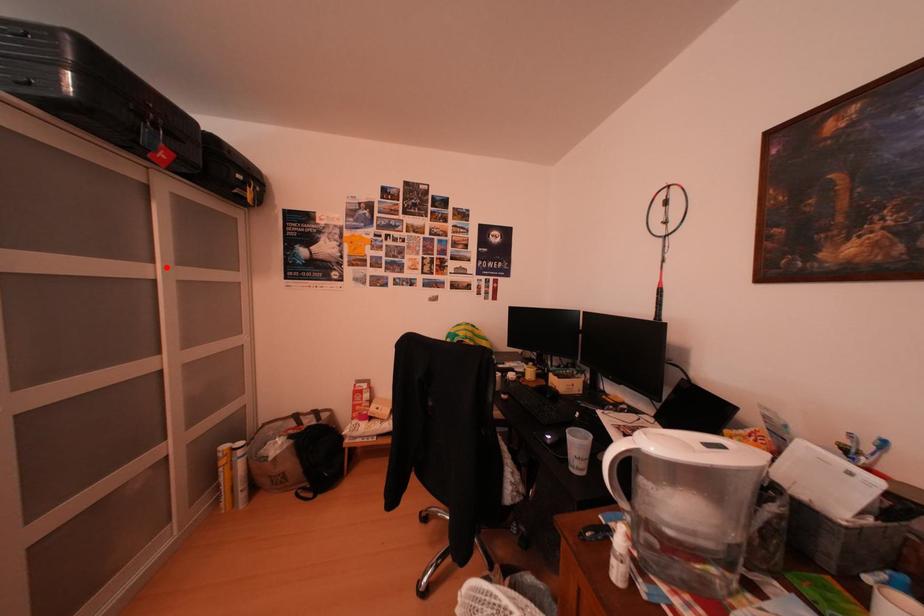
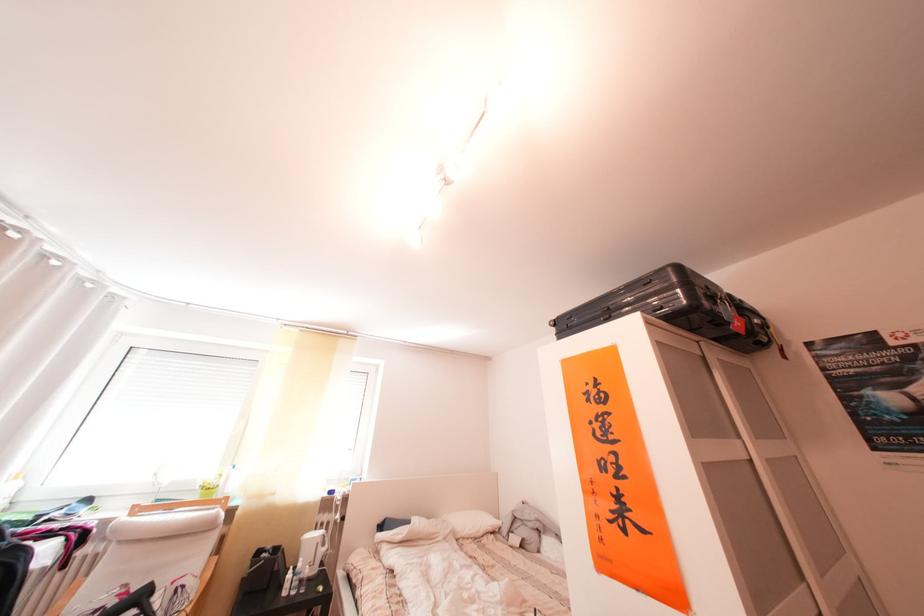
Find the pixel in the second image that matches the highlighted location in the first image.

(751, 442)